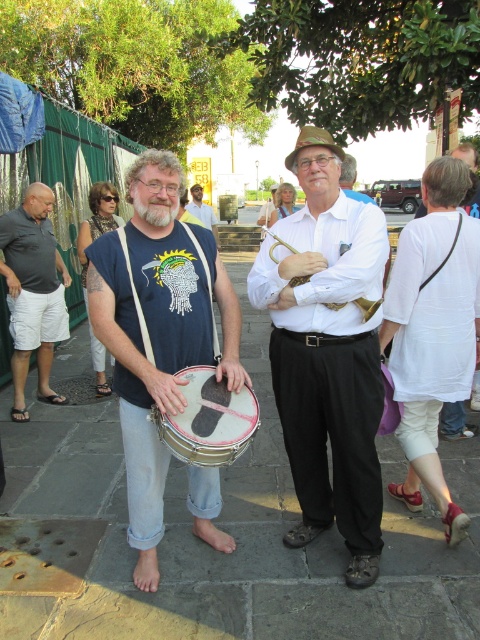
You are at the event and want to take a photo of the gold brass trumpet at center. Where should you position yourself relative to the two individuals to capture it in the frame?

The gold brass trumpet at center is located at point (368,307), so you should position yourself between the two individuals to capture it in the frame.

In the scene shown: You are a photographer at the event and want to capture both the white cotton shirt at center and the matte blue shirt at center in a single shot. Which shirt should you focus on first to ensure both are in frame?

The white cotton shirt at center is positioned under the matte blue shirt at center, so focusing on the matte blue shirt at center first will ensure both are captured in the frame.

You are a photographer trying to capture both the white cotton shirt at center and the matte blue shirt at center in a single shot. Based on their positions, which one should you focus on first to ensure both are in frame?

The white cotton shirt at center is in front of the matte blue shirt at center, so focusing on the white cotton shirt at center first will ensure both are in frame.